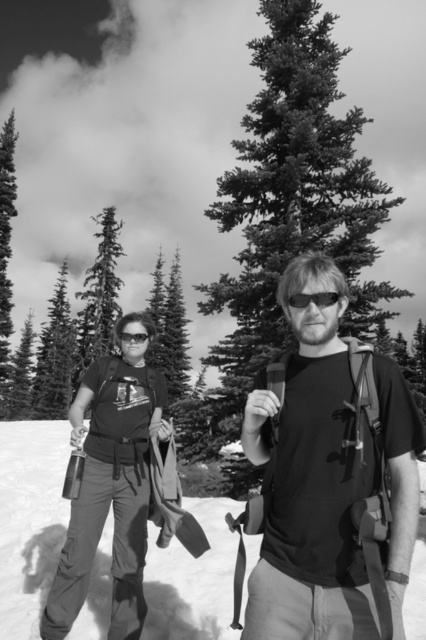
You are standing at the point with coordinates point (123, 333) and want to walk to the point with coordinates point (261, 259). Which direction should you face to move towards your destination?

To move from point (123, 333) to point (261, 259), you should face north because point (261, 259) is behind point (123, 333).